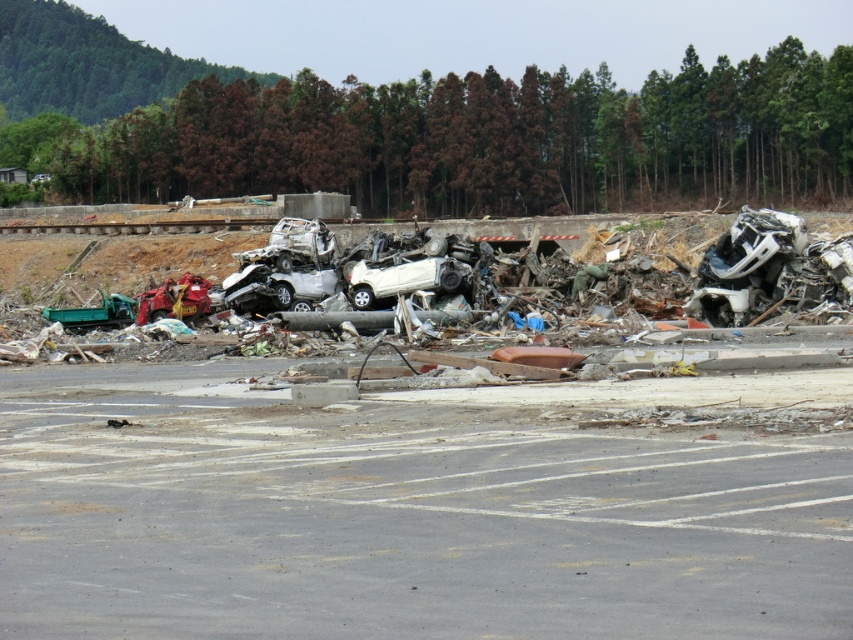
You are a rescue worker trying to reach the midground area where the large pile of wrecked vehicles is located. Your path leads you from the top of the image towards the gray asphalt parking lot at lower center. Is the parking lot positioned closer to the bottom or the top of the image?

The gray asphalt parking lot at lower center is located at point 0.814 on the y axis, which is closer to the bottom of the image since lower y values are closer to the bottom. Therefore, the parking lot is positioned closer to the bottom of the image.

You are a rescue worker trying to navigate through the disaster area. You need to reach the metallic red motorcycle at left to check for survivors. From your current position at the gray asphalt parking lot at lower center, which direction should you move to reach the motorcycle?

You should move to the left from the gray asphalt parking lot at lower center to reach the metallic red motorcycle at left since the parking lot is to the right of the motorcycle.